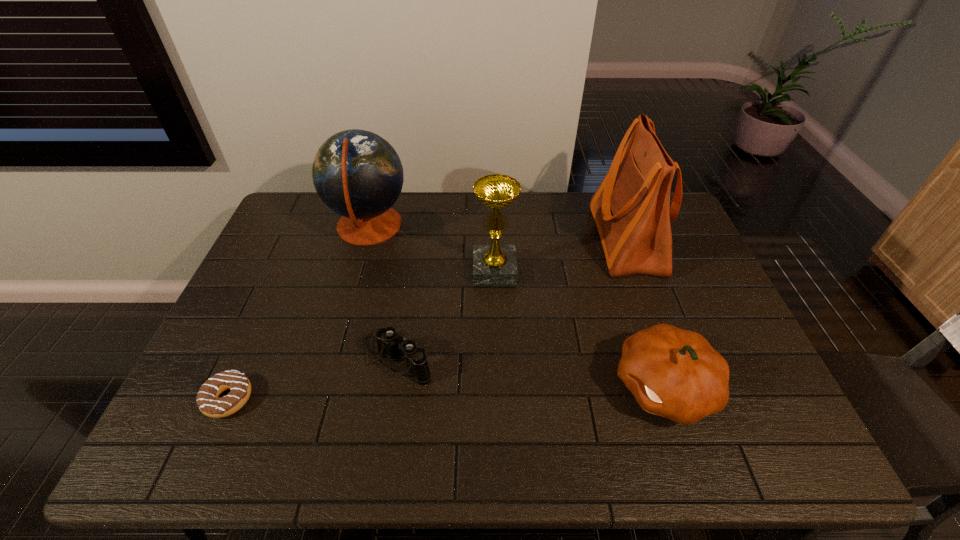
Find the location of a particular element. This screenshot has width=960, height=540. vacant space at the near right corner of the desktop is located at coordinates (789, 439).

Identify the location of empty space between the fourth tallest object and the award. This screenshot has width=960, height=540. (579, 328).

Locate an element on the screen. The height and width of the screenshot is (540, 960). vacant space in between the third tallest object and the leftmost object is located at coordinates (361, 334).

I want to click on free space between the shopping bag and the fourth tallest object, so click(645, 314).

Locate an element on the screen. The width and height of the screenshot is (960, 540). vacant area between the leftmost object and the fourth shortest object is located at coordinates (361, 334).

Where is `vacant area between the shopping bag and the doughnut`? vacant area between the shopping bag and the doughnut is located at coordinates (427, 319).

Where is `empty space that is in between the fifth tallest object and the globe`? Image resolution: width=960 pixels, height=540 pixels. empty space that is in between the fifth tallest object and the globe is located at coordinates (382, 292).

What are the coordinates of `free space between the doughnut and the binoculars` in the screenshot? It's located at (312, 377).

I want to click on empty location between the shopping bag and the doughnut, so click(427, 319).

Identify the location of free space that is in between the third shortest object and the globe. This screenshot has width=960, height=540. (516, 307).